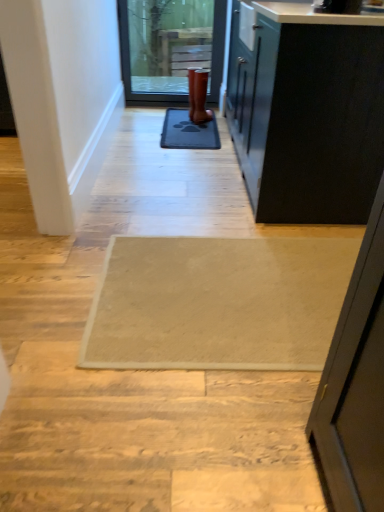
Identify the location of empty space that is ontop of beige textured rug at center. The height and width of the screenshot is (512, 384). (236, 286).